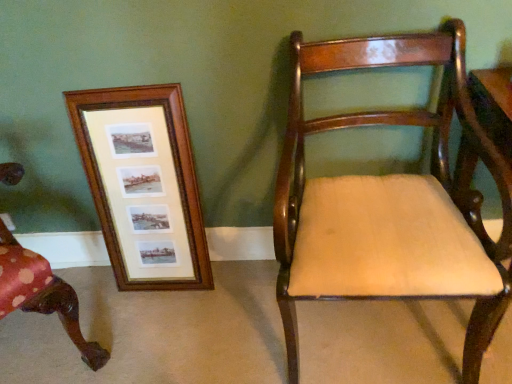
This screenshot has width=512, height=384. What are the coordinates of `vacant space underneath mahogany wood chair at right, which is the 2th chair from left to right (from a real-world perspective)` in the screenshot? It's located at (367, 338).